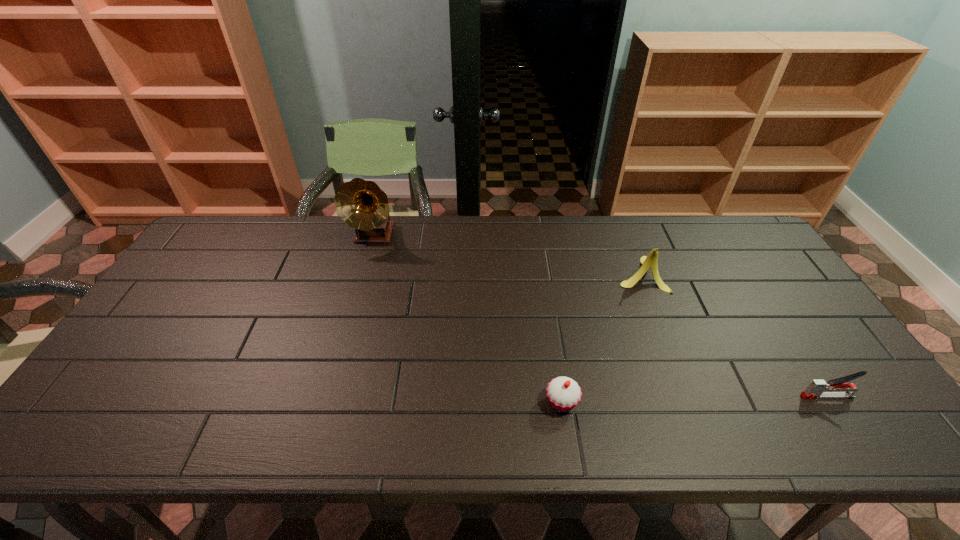
You are a GUI agent. You are given a task and a screenshot of the screen. Output one action in this format:
    pyautogui.click(x=<x>, y=<y>)
    Task: Click on the vacant space at the left edge of the desktop
    
    Given the screenshot: What is the action you would take?
    pyautogui.click(x=184, y=307)

Image resolution: width=960 pixels, height=540 pixels. In order to click on free region at the right edge in this screenshot , I will do `click(796, 374)`.

Image resolution: width=960 pixels, height=540 pixels. Identify the location of vacant region at the far left corner of the desktop. (216, 252).

This screenshot has height=540, width=960. What are the coordinates of `vacant space in between the leftmost object and the rightmost object` in the screenshot? It's located at 601,316.

Identify the location of free space that is in between the phonograph_record and the second object from right to left. (508, 255).

Where is `free area in between the second object from right to left and the second shortest object`? free area in between the second object from right to left and the second shortest object is located at coordinates (733, 335).

The height and width of the screenshot is (540, 960). Identify the location of free space between the second tallest object and the second object from left to right. (601, 338).

Identify the location of free spot between the second shortest object and the cupcake. (694, 399).

This screenshot has height=540, width=960. What are the coordinates of `empty location between the second shortest object and the banana` in the screenshot? It's located at (733, 335).

The width and height of the screenshot is (960, 540). I want to click on free spot between the phonograph_record and the third object from right to left, so click(x=468, y=319).